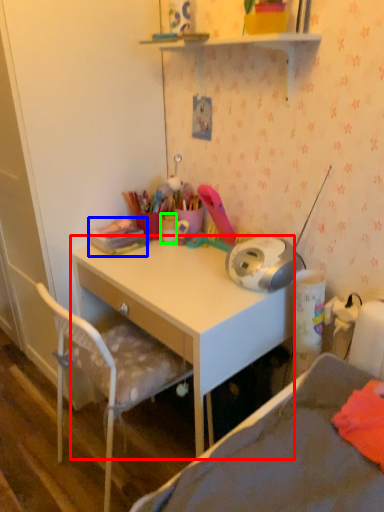
Question: Which object is the farthest from desk (highlighted by a red box)? Choose among these: stationery (highlighted by a blue box) or stationery (highlighted by a green box).

Choices:
 (A) stationery
 (B) stationery

Answer: (B)